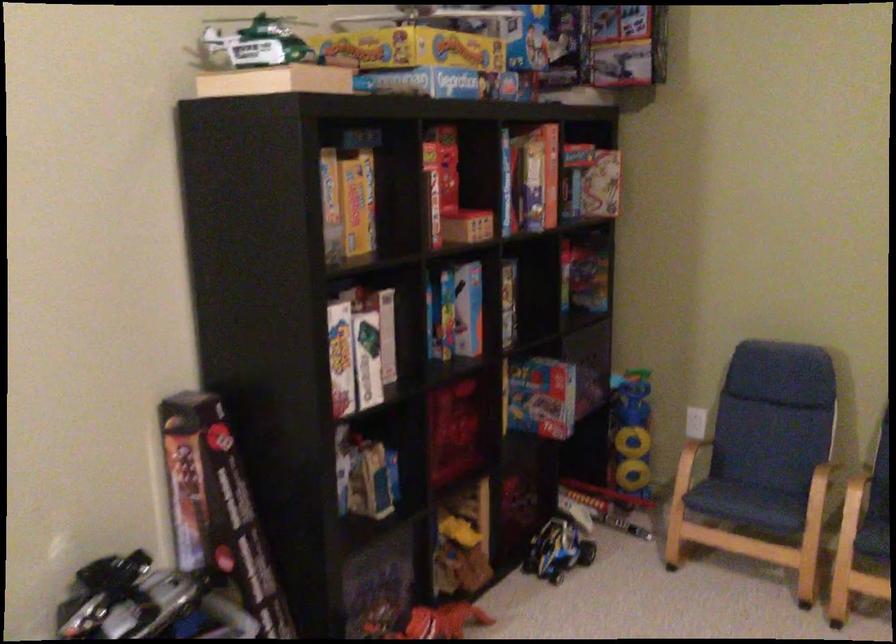
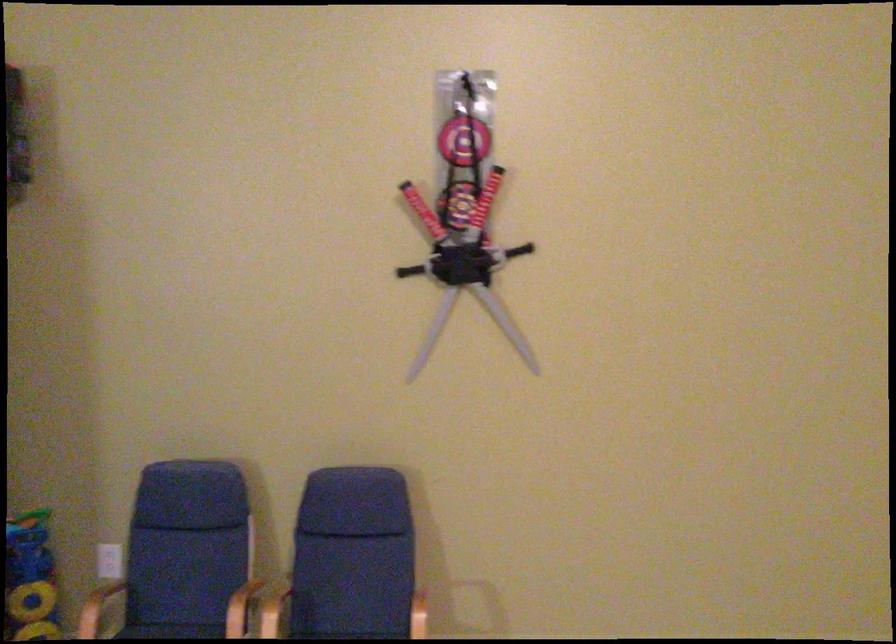
In the second image, find the point that corresponds to the point at 754,488 in the first image.

(169, 630)